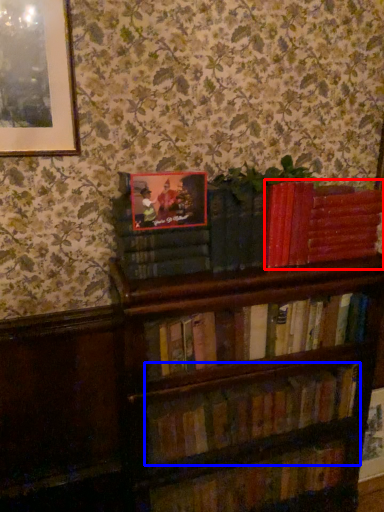
Question: Which object appears farthest to the camera in this image, book (highlighted by a red box) or book (highlighted by a blue box)?

Choices:
 (A) book
 (B) book

Answer: (A)